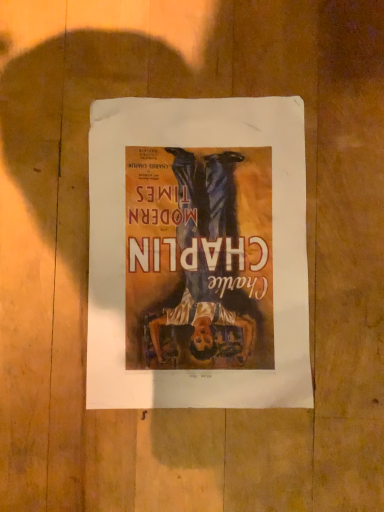
At what (x,y) coordinates should I click in order to perform the action: click on free spot above matte paper poster at center (from a real-world perspective). Please return your answer as a coordinate pair (x, y). This screenshot has width=384, height=512. Looking at the image, I should click on (200, 268).